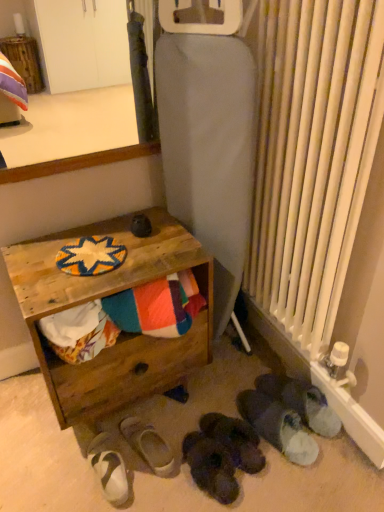
Identify the location of vacant area that is in front of white fabric slipper at lower center, the 2th footwear in the left-to-right sequence. The image size is (384, 512). (150, 489).